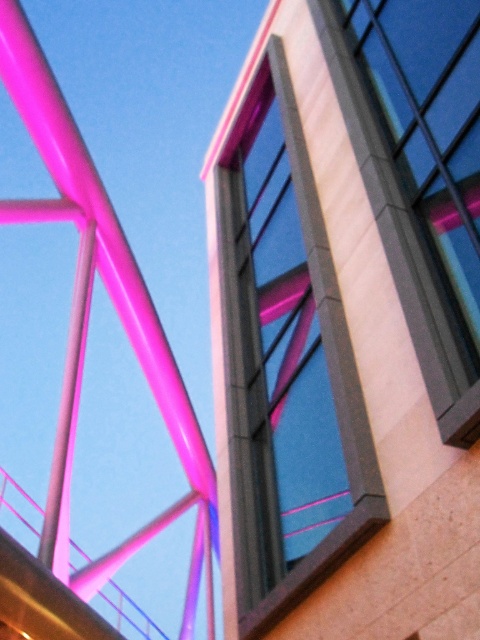
Question: Does matte glass window at center lie behind matte glass window at upper right?

Choices:
 (A) no
 (B) yes

Answer: (A)

Question: Is matte glass window at center bigger than matte glass window at upper right?

Choices:
 (A) yes
 (B) no

Answer: (A)

Question: Is matte glass window at center thinner than matte glass window at upper right?

Choices:
 (A) yes
 (B) no

Answer: (B)

Question: Which point is farther to the camera?

Choices:
 (A) matte glass window at center
 (B) matte glass window at upper right

Answer: (B)

Question: Which point is closer to the camera?

Choices:
 (A) matte glass window at upper right
 (B) matte glass window at center

Answer: (B)